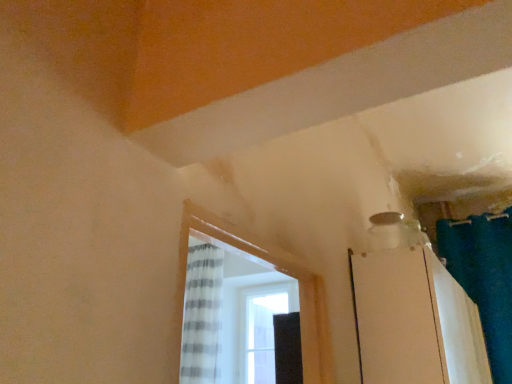
Question: From a real-world perspective, is teal fabric shower curtain at upper right above or below white glossy screen door at upper right?

Choices:
 (A) below
 (B) above

Answer: (B)

Question: Is teal fabric shower curtain at upper right wider or thinner than white glossy screen door at upper right?

Choices:
 (A) wide
 (B) thin

Answer: (B)

Question: In terms of height, does teal fabric shower curtain at upper right look taller or shorter compared to white glossy screen door at upper right?

Choices:
 (A) tall
 (B) short

Answer: (A)

Question: From the image's perspective, relative to teal fabric shower curtain at upper right, is white glossy screen door at upper right above or below?

Choices:
 (A) below
 (B) above

Answer: (A)

Question: In terms of height, does white glossy screen door at upper right look taller or shorter compared to teal fabric shower curtain at upper right?

Choices:
 (A) short
 (B) tall

Answer: (A)

Question: Relative to teal fabric shower curtain at upper right, is white glossy screen door at upper right in front or behind?

Choices:
 (A) behind
 (B) front

Answer: (B)

Question: Do you think white glossy screen door at upper right is within teal fabric shower curtain at upper right, or outside of it?

Choices:
 (A) outside
 (B) inside

Answer: (A)